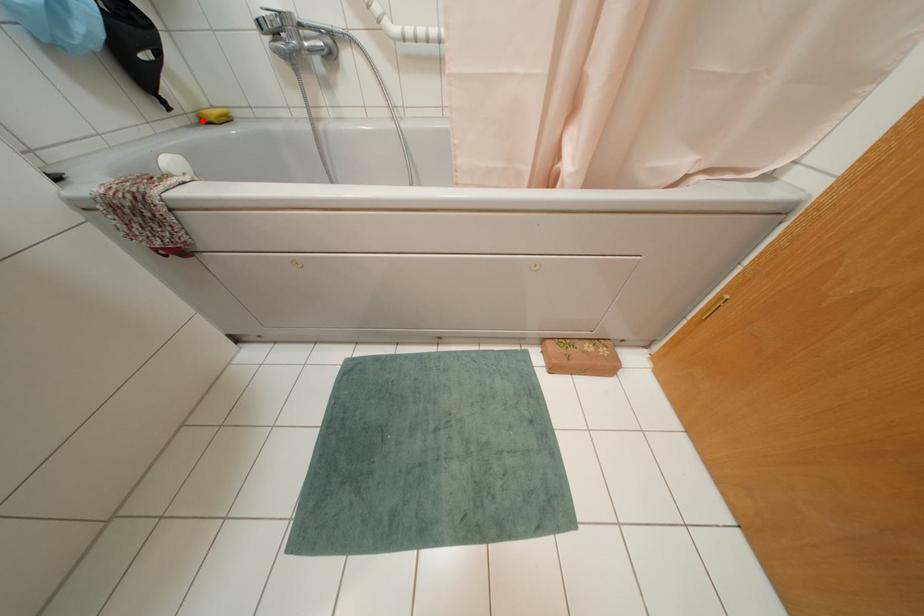
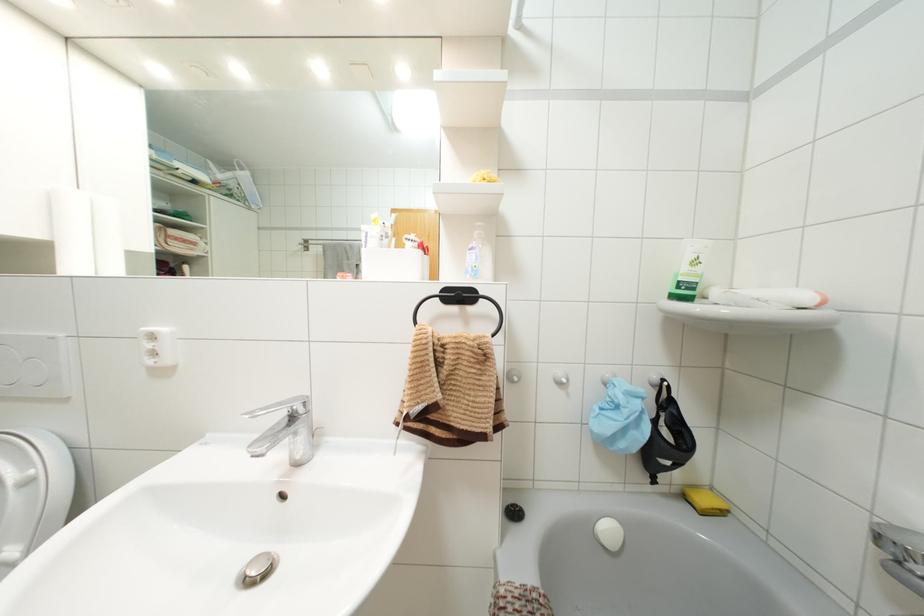
Question: I am providing you with two images of the same scene from different viewpoints. A red point is marked on the first image. Can you still see the location of the red point in image 2?

Choices:
 (A) Yes
 (B) No

Answer: (A)